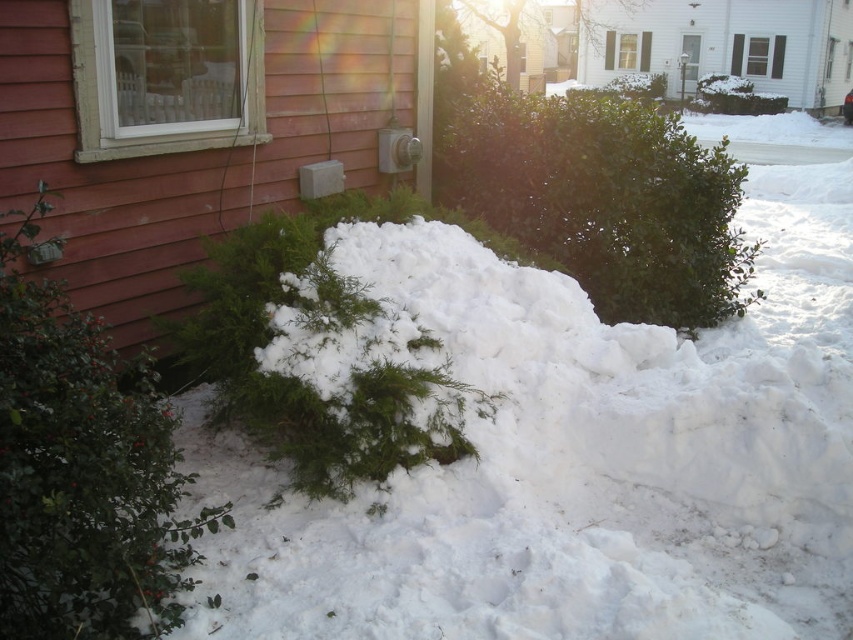
Between green leafy bush at lower left and green leafy bush at center, which one appears on the left side from the viewer's perspective?

Positioned to the left is green leafy bush at lower left.

Is point (117, 534) positioned after point (625, 124)?

No, (117, 534) is in front of (625, 124).

Locate an element on the screen. Image resolution: width=853 pixels, height=640 pixels. green leafy bush at lower left is located at coordinates (82, 468).